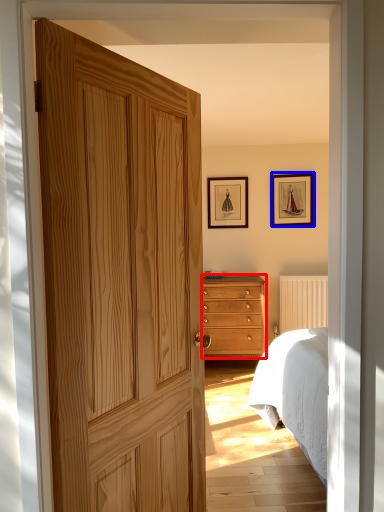
Question: Which object is further to the camera taking this photo, chest of drawers (highlighted by a red box) or picture frame (highlighted by a blue box)?

Choices:
 (A) chest of drawers
 (B) picture frame

Answer: (B)